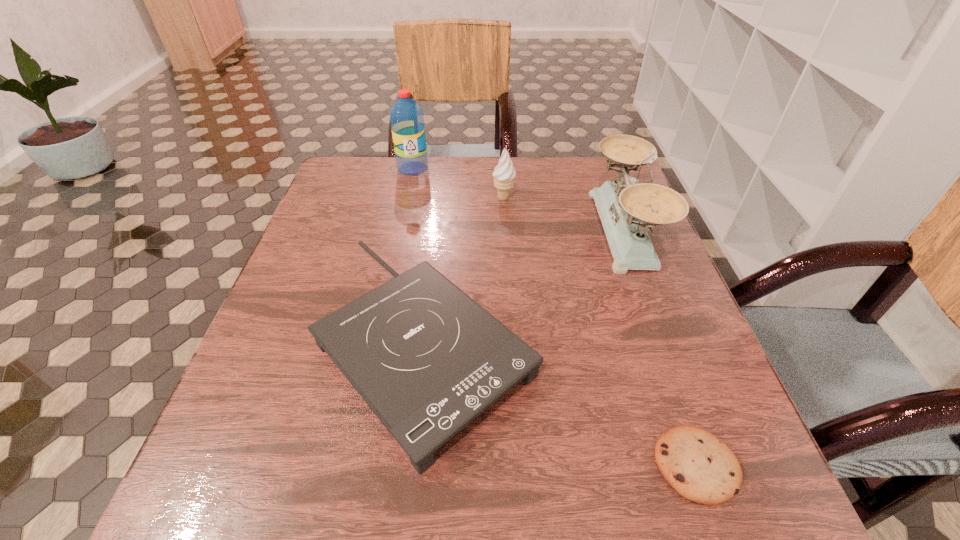
Find the location of a particular element. The image size is (960, 540). vacant space in between the shortest object and the second shortest object is located at coordinates (561, 403).

I want to click on vacant point located between the water bottle and the scale, so click(x=518, y=199).

This screenshot has width=960, height=540. I want to click on empty space that is in between the water bottle and the third shortest object, so click(458, 183).

The image size is (960, 540). What are the coordinates of `vacant area that lies between the cookie and the icecream` in the screenshot? It's located at (599, 332).

Find the location of `free spot between the shortest object and the icecream`. free spot between the shortest object and the icecream is located at coordinates (599, 332).

Where is `unoccupied position between the water bottle and the icecream`? This screenshot has height=540, width=960. unoccupied position between the water bottle and the icecream is located at coordinates (458, 183).

Identify the location of free space between the scale and the water bottle. This screenshot has height=540, width=960. (518, 199).

Where is `vacant area that lies between the scale and the shortest object`? vacant area that lies between the scale and the shortest object is located at coordinates (660, 348).

You are a GUI agent. You are given a task and a screenshot of the screen. Output one action in this format:
    pyautogui.click(x=<x>, y=<y>)
    Task: Click on the free space between the hotplate and the scale
    Image resolution: width=960 pixels, height=540 pixels.
    Given the screenshot: What is the action you would take?
    pyautogui.click(x=525, y=286)

Where is `free space between the cookie and the farthest object`? The width and height of the screenshot is (960, 540). free space between the cookie and the farthest object is located at coordinates (554, 317).